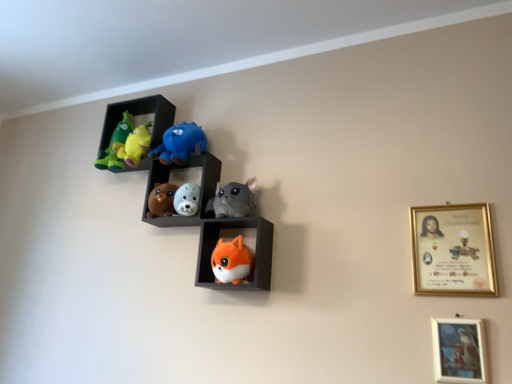
What do you see at coordinates (180, 143) in the screenshot? This screenshot has width=512, height=384. I see `matte blue plush at upper center, the 5th toy from the bottom` at bounding box center [180, 143].

What do you see at coordinates (459, 351) in the screenshot?
I see `gold-framed painting at lower right, which ranks as the 2th picture frame in top-to-bottom order` at bounding box center [459, 351].

This screenshot has height=384, width=512. Describe the element at coordinates (453, 250) in the screenshot. I see `gold-framed certificate at upper right, the second picture frame from the bottom` at that location.

What is the approximate height of gray plush cat at center, arranged as the fourth toy when ordered from the bottom?

The height of gray plush cat at center, arranged as the fourth toy when ordered from the bottom, is 6.75 inches.

Measure the distance between point (116, 120) and camera.

The distance of point (116, 120) from camera is 1.88 meters.

Find the location of a particular element. This screenshot has width=512, height=384. velvet plush toys at upper left, which is the first shelf from top to bottom is located at coordinates (139, 114).

Image resolution: width=512 pixels, height=384 pixels. I want to click on fluffy plush toys at center, arranged as the second shelf when viewed from the top, so click(184, 182).

What are the coordinates of `fluffy orange fox at center, which is counted as the 1th shelf, starting from the bottom` in the screenshot? It's located at (256, 252).

Locate an element on the screen. This screenshot has width=512, height=384. matte blue plush at upper center, the 5th toy from the bottom is located at coordinates (180, 143).

Based on the photo, considering the sizes of objects matte blue plush at upper center, the 5th toy from the bottom, and gold-framed painting at lower right, which ranks as the 2th picture frame in top-to-bottom order, in the image provided, who is taller, matte blue plush at upper center, the 5th toy from the bottom, or gold-framed painting at lower right, which ranks as the 2th picture frame in top-to-bottom order,?

With more height is matte blue plush at upper center, the 5th toy from the bottom.

Is matte blue plush at upper center, the 5th toy from the bottom, to the left or to the right of gold-framed painting at lower right, which ranks as the 2th picture frame in top-to-bottom order, in the image?

Based on their positions, matte blue plush at upper center, the 5th toy from the bottom, is located to the left of gold-framed painting at lower right, which ranks as the 2th picture frame in top-to-bottom order.

Is gold-framed painting at lower right, which ranks as the 2th picture frame in top-to-bottom order, located within matte blue plush at upper center, the 5th toy from the bottom?

No, gold-framed painting at lower right, which ranks as the 2th picture frame in top-to-bottom order, is not inside matte blue plush at upper center, the 5th toy from the bottom.

Is matte blue plush at upper center, the 5th toy from the bottom, not near gold-framed painting at lower right, which ranks as the 2th picture frame in top-to-bottom order?

Indeed, matte blue plush at upper center, the 5th toy from the bottom, is not near gold-framed painting at lower right, which ranks as the 2th picture frame in top-to-bottom order.

Is matte blue plush at upper center, arranged as the 1th toy when viewed from the top, facing away from fluffy orange fox at lower center, which ranks as the fifth toy in top-to-bottom order?

That's not correct — matte blue plush at upper center, arranged as the 1th toy when viewed from the top, is not looking away from fluffy orange fox at lower center, which ranks as the fifth toy in top-to-bottom order.

Is matte blue plush at upper center, the 5th toy from the bottom, further to the viewer compared to fluffy orange fox at lower center, which ranks as the fifth toy in top-to-bottom order?

Yes, matte blue plush at upper center, the 5th toy from the bottom, is further from the viewer.

There is a matte blue plush at upper center, the 5th toy from the bottom. In order to click on the 4th toy below it (from the image's perspective) in this screenshot , I will do tap(233, 261).

From a real-world perspective, is matte blue plush at upper center, the 5th toy from the bottom, physically above fluffy orange fox at lower center, which ranks as the fifth toy in top-to-bottom order?

Yes.

Based on the photo, from a real-world perspective, which object rests below the other?

In real-world perspective, fluffy orange fox at lower center, which appears as the 1th toy when ordered from the bottom, is lower.

Is fluffy orange fox at center, arranged as the 3th shelf when viewed from the top, bigger or smaller than fluffy orange fox at lower center, which ranks as the fifth toy in top-to-bottom order?

Clearly, fluffy orange fox at center, arranged as the 3th shelf when viewed from the top, is larger in size than fluffy orange fox at lower center, which ranks as the fifth toy in top-to-bottom order.

Between fluffy orange fox at center, which is counted as the 1th shelf, starting from the bottom, and fluffy orange fox at lower center, which appears as the 1th toy when ordered from the bottom, which one has less height?

fluffy orange fox at lower center, which appears as the 1th toy when ordered from the bottom.

Based on the photo, who is more distant, fluffy orange fox at center, arranged as the 3th shelf when viewed from the top, or fluffy orange fox at lower center, which ranks as the fifth toy in top-to-bottom order?

Positioned behind is fluffy orange fox at lower center, which ranks as the fifth toy in top-to-bottom order.

From the image's perspective, which one is positioned higher, gold-framed certificate at upper right, which is the first picture frame from top to bottom, or fluffy orange fox at center, which is counted as the 1th shelf, starting from the bottom?

gold-framed certificate at upper right, which is the first picture frame from top to bottom, is shown above in the image.

Where is `picture frame lying above the fluffy orange fox at center, arranged as the 3th shelf when viewed from the top (from the image's perspective)`? picture frame lying above the fluffy orange fox at center, arranged as the 3th shelf when viewed from the top (from the image's perspective) is located at coordinates (453, 250).

From the picture: Considering the sizes of objects gold-framed certificate at upper right, which is the first picture frame from top to bottom, and fluffy orange fox at center, arranged as the 3th shelf when viewed from the top, in the image provided, who is smaller, gold-framed certificate at upper right, which is the first picture frame from top to bottom, or fluffy orange fox at center, arranged as the 3th shelf when viewed from the top,?

With smaller size is gold-framed certificate at upper right, which is the first picture frame from top to bottom.

How different are the orientations of gold-framed certificate at upper right, which is the first picture frame from top to bottom, and fluffy orange fox at center, which is counted as the 1th shelf, starting from the bottom, in degrees?

The facing directions of gold-framed certificate at upper right, which is the first picture frame from top to bottom, and fluffy orange fox at center, which is counted as the 1th shelf, starting from the bottom, are 0.32 degrees apart.

From the image's perspective, is fluffy white plush seal at center, positioned as the fourth toy in top-to-bottom order, over fluffy orange fox at center, arranged as the 3th shelf when viewed from the top?

Correct, fluffy white plush seal at center, positioned as the fourth toy in top-to-bottom order, appears higher than fluffy orange fox at center, arranged as the 3th shelf when viewed from the top, in the image.

Between fluffy white plush seal at center, positioned as the fourth toy in top-to-bottom order, and fluffy orange fox at center, which is counted as the 1th shelf, starting from the bottom, which one has less height?

fluffy white plush seal at center, positioned as the fourth toy in top-to-bottom order.

The height and width of the screenshot is (384, 512). What are the coordinates of `shelf below the fluffy white plush seal at center, which is counted as the second toy, starting from the bottom (from the image's perspective)` in the screenshot? It's located at (256, 252).

Looking at this image, from a real-world perspective, is fluffy white plush seal at center, which is counted as the second toy, starting from the bottom, physically above fluffy orange fox at center, which is counted as the 1th shelf, starting from the bottom?

Yes, from a real-world perspective, fluffy white plush seal at center, which is counted as the second toy, starting from the bottom, is over fluffy orange fox at center, which is counted as the 1th shelf, starting from the bottom

Find the location of a particular element. picture frame below the fluffy orange fox at center, arranged as the 3th shelf when viewed from the top (from the image's perspective) is located at coordinates (459, 351).

Is point (481, 353) more distant than point (262, 272)?

That is False.

From the image's perspective, relative to fluffy orange fox at center, arranged as the 3th shelf when viewed from the top, is gold-framed painting at lower right, which ranks as the 2th picture frame in top-to-bottom order, above or below?

Based on their image positions, gold-framed painting at lower right, which ranks as the 2th picture frame in top-to-bottom order, is located beneath fluffy orange fox at center, arranged as the 3th shelf when viewed from the top.

Is gold-framed painting at lower right, which ranks as the 1th picture frame in bottom-to-top order, positioned far away from fluffy orange fox at center, arranged as the 3th shelf when viewed from the top?

No, there isn't a large distance between gold-framed painting at lower right, which ranks as the 1th picture frame in bottom-to-top order, and fluffy orange fox at center, arranged as the 3th shelf when viewed from the top.

Would you consider soft plush toys at center, the third toy in the bottom-to-top sequence, to be distant from fluffy orange fox at lower center, which appears as the 1th toy when ordered from the bottom?

No.

In terms of width, does soft plush toys at center, the third toy in the bottom-to-top sequence, look wider or thinner when compared to fluffy orange fox at lower center, which ranks as the fifth toy in top-to-bottom order?

In the image, soft plush toys at center, the third toy in the bottom-to-top sequence, appears to be wider than fluffy orange fox at lower center, which ranks as the fifth toy in top-to-bottom order.

From a real-world perspective, count 3rd toys upward from the fluffy orange fox at lower center, which ranks as the fifth toy in top-to-bottom order, and point to it. Please provide its 2D coordinates.

[(161, 200)]

Which is in front, soft plush toys at center, which is the 3th toy in top-to-bottom order, or fluffy orange fox at lower center, which appears as the 1th toy when ordered from the bottom?

fluffy orange fox at lower center, which appears as the 1th toy when ordered from the bottom.

Which toy is the 5th one when counting from the back of the gold-framed painting at lower right, which ranks as the 2th picture frame in top-to-bottom order? Please provide its 2D coordinates.

[(180, 143)]

From the image's perspective, starting from the matte blue plush at upper center, arranged as the 1th toy when viewed from the top, which toy is the 4th one below? Please provide its 2D coordinates.

[(233, 261)]

Considering their positions, is matte blue plush at upper center, the 5th toy from the bottom, positioned further to velvet plush toys at upper left, the 3th shelf in the bottom-to-top sequence, than fluffy plush toys at center, arranged as the second shelf when viewed from the top?

Based on the image, fluffy plush toys at center, arranged as the second shelf when viewed from the top, appears to be further to velvet plush toys at upper left, the 3th shelf in the bottom-to-top sequence.

From the image, which object appears to be nearer to soft plush toys at center, the third toy in the bottom-to-top sequence, fluffy plush toys at center, arranged as the second shelf when viewed from the top, or fluffy orange fox at lower center, which ranks as the fifth toy in top-to-bottom order?

Among the two, fluffy plush toys at center, arranged as the second shelf when viewed from the top, is located nearer to soft plush toys at center, the third toy in the bottom-to-top sequence.

Based on their spatial positions, is fluffy white plush seal at center, which is counted as the second toy, starting from the bottom, or fluffy orange fox at center, arranged as the 3th shelf when viewed from the top, further from gold-framed painting at lower right, which ranks as the 2th picture frame in top-to-bottom order?

fluffy white plush seal at center, which is counted as the second toy, starting from the bottom, lies further to gold-framed painting at lower right, which ranks as the 2th picture frame in top-to-bottom order, than the other object.

Estimate the real-world distances between objects in this image. Which object is closer to gray plush cat at center, which appears as the 2th toy when viewed from the top, fluffy plush toys at center, arranged as the second shelf when viewed from the top, or fluffy white plush seal at center, positioned as the fourth toy in top-to-bottom order?

fluffy white plush seal at center, positioned as the fourth toy in top-to-bottom order, is positioned closer to the anchor gray plush cat at center, which appears as the 2th toy when viewed from the top.

Estimate the real-world distances between objects in this image. Which object is further from gold-framed painting at lower right, which ranks as the 1th picture frame in bottom-to-top order, soft plush toys at center, which is the 3th toy in top-to-bottom order, or velvet plush toys at upper left, the 3th shelf in the bottom-to-top sequence?

The object further to gold-framed painting at lower right, which ranks as the 1th picture frame in bottom-to-top order, is velvet plush toys at upper left, the 3th shelf in the bottom-to-top sequence.

Considering their positions, is matte blue plush at upper center, the 5th toy from the bottom, positioned further to gray plush cat at center, which appears as the 2th toy when viewed from the top, than gold-framed certificate at upper right, the second picture frame from the bottom?

gold-framed certificate at upper right, the second picture frame from the bottom, is further to gray plush cat at center, which appears as the 2th toy when viewed from the top.

Considering their positions, is gold-framed painting at lower right, which ranks as the 1th picture frame in bottom-to-top order, positioned closer to matte blue plush at upper center, arranged as the 1th toy when viewed from the top, than fluffy orange fox at center, arranged as the 3th shelf when viewed from the top?

fluffy orange fox at center, arranged as the 3th shelf when viewed from the top, is closer to matte blue plush at upper center, arranged as the 1th toy when viewed from the top.

Looking at the image, which one is located closer to fluffy orange fox at lower center, which ranks as the fifth toy in top-to-bottom order, gold-framed painting at lower right, which ranks as the 1th picture frame in bottom-to-top order, or gold-framed certificate at upper right, the second picture frame from the bottom?

gold-framed certificate at upper right, the second picture frame from the bottom, is positioned closer to the anchor fluffy orange fox at lower center, which ranks as the fifth toy in top-to-bottom order.

At what (x,y) coordinates should I click in order to perform the action: click on picture frame between fluffy orange fox at lower center, which appears as the 1th toy when ordered from the bottom, and gold-framed certificate at upper right, which is the first picture frame from top to bottom. Please return your answer as a coordinate pair (x, y). The image size is (512, 384). Looking at the image, I should click on (459, 351).

This screenshot has height=384, width=512. What are the coordinates of `shelf between fluffy orange fox at center, which is counted as the 1th shelf, starting from the bottom, and soft plush toys at center, which is the 3th toy in top-to-bottom order, from front to back` in the screenshot? It's located at [184, 182].

Where is `picture frame located between fluffy white plush seal at center, positioned as the fourth toy in top-to-bottom order, and gold-framed certificate at upper right, which is the first picture frame from top to bottom, in the left-right direction`? The width and height of the screenshot is (512, 384). picture frame located between fluffy white plush seal at center, positioned as the fourth toy in top-to-bottom order, and gold-framed certificate at upper right, which is the first picture frame from top to bottom, in the left-right direction is located at coordinates (459, 351).

The width and height of the screenshot is (512, 384). I want to click on picture frame located between fluffy plush toys at center, marked as the 2th shelf in a bottom-to-top arrangement, and gold-framed certificate at upper right, the second picture frame from the bottom, in the left-right direction, so click(459, 351).